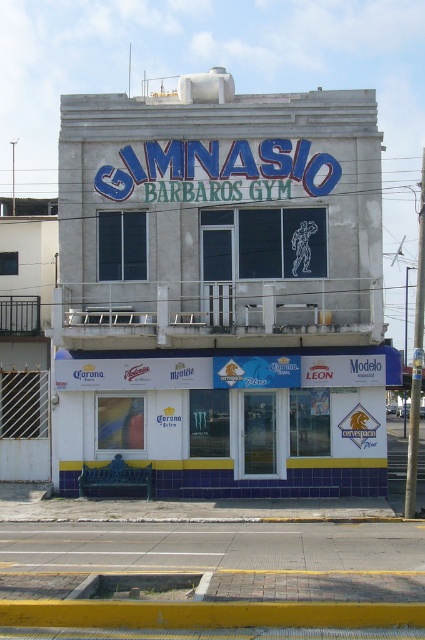
Question: Can you confirm if white concrete building at center is positioned below blue tile bench at lower center?

Choices:
 (A) yes
 (B) no

Answer: (B)

Question: Considering the real-world distances, which object is farthest from the blue tile bench at lower center?

Choices:
 (A) yellow concrete curb at lower center
 (B) white concrete building at center

Answer: (A)

Question: Estimate the real-world distances between objects in this image. Which object is closer to the white concrete building at center?

Choices:
 (A) blue tile bench at lower center
 (B) yellow concrete curb at lower center

Answer: (A)

Question: Can you confirm if blue tile bench at lower center is smaller than yellow concrete curb at lower center?

Choices:
 (A) no
 (B) yes

Answer: (B)

Question: Which of the following is the closest to the observer?

Choices:
 (A) blue tile bench at lower center
 (B) white concrete building at center

Answer: (B)

Question: Observing the image, what is the correct spatial positioning of white concrete building at center in reference to blue tile bench at lower center?

Choices:
 (A) left
 (B) right

Answer: (B)